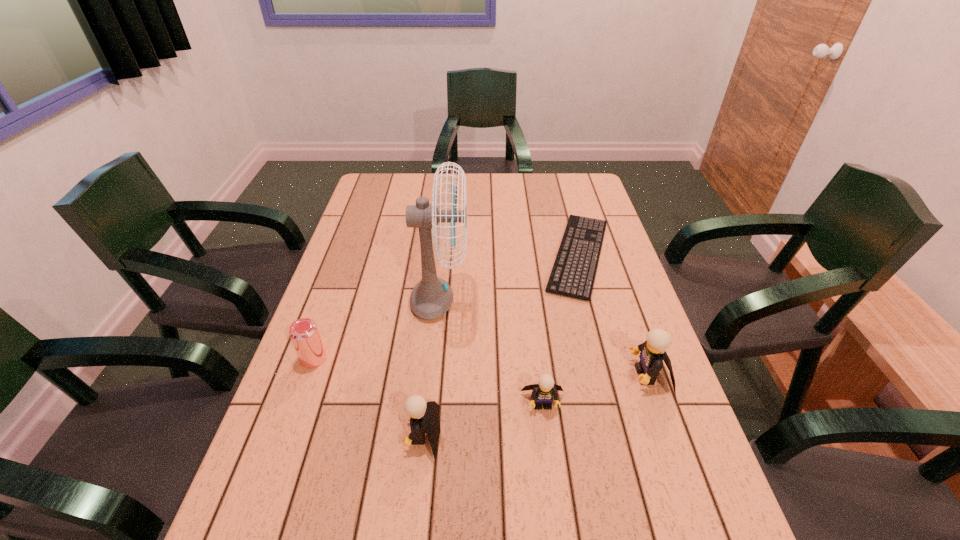
Find the location of a particular element. The height and width of the screenshot is (540, 960). vacant area that lies between the tallest Lego and the second Lego from right to left is located at coordinates tap(595, 389).

At what (x,y) coordinates should I click in order to perform the action: click on free space between the second Lego from left to right and the leftmost Lego. Please return your answer as a coordinate pair (x, y). The image size is (960, 540). Looking at the image, I should click on (483, 418).

Locate an element on the screen. free space that is in between the tallest object and the tallest Lego is located at coordinates (544, 339).

The height and width of the screenshot is (540, 960). In order to click on empty space that is in between the tallest Lego and the beer can in this screenshot , I will do `click(481, 367)`.

In order to click on vacant point located between the second Lego from right to left and the leftmost object in this screenshot , I will do pyautogui.click(x=428, y=381).

The height and width of the screenshot is (540, 960). Identify the location of object identified as the second closest to the computer keyboard. (432, 297).

Identify the location of object that is the closest one to the leftmost object. (432, 297).

Identify which Lego is located as the second nearest to the fan. Please provide its 2D coordinates. Your answer should be formatted as a tuple, i.e. [(x, y)], where the tuple contains the x and y coordinates of a point satisfying the conditions above.

[(424, 417)]

Point out which Lego is positioned as the nearest to the second Lego from left to right. Please provide its 2D coordinates. Your answer should be formatted as a tuple, i.e. [(x, y)], where the tuple contains the x and y coordinates of a point satisfying the conditions above.

[(653, 351)]

You are a GUI agent. You are given a task and a screenshot of the screen. Output one action in this format:
    pyautogui.click(x=<x>, y=<y>)
    Task: Click on the free spot that satisfies the following two spatial constraints: 1. on the front-facing side of the shortest Lego; 2. on the front-facing side of the leftmost Lego
    Image resolution: width=960 pixels, height=540 pixels.
    Given the screenshot: What is the action you would take?
    pyautogui.click(x=546, y=434)